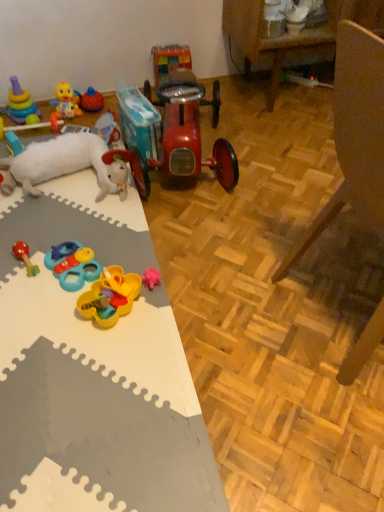
Locate an element on the screen. vacant space in between shiny red car at center, which is the first toy in right-to-left order, and white foam mat at left is located at coordinates (208, 277).